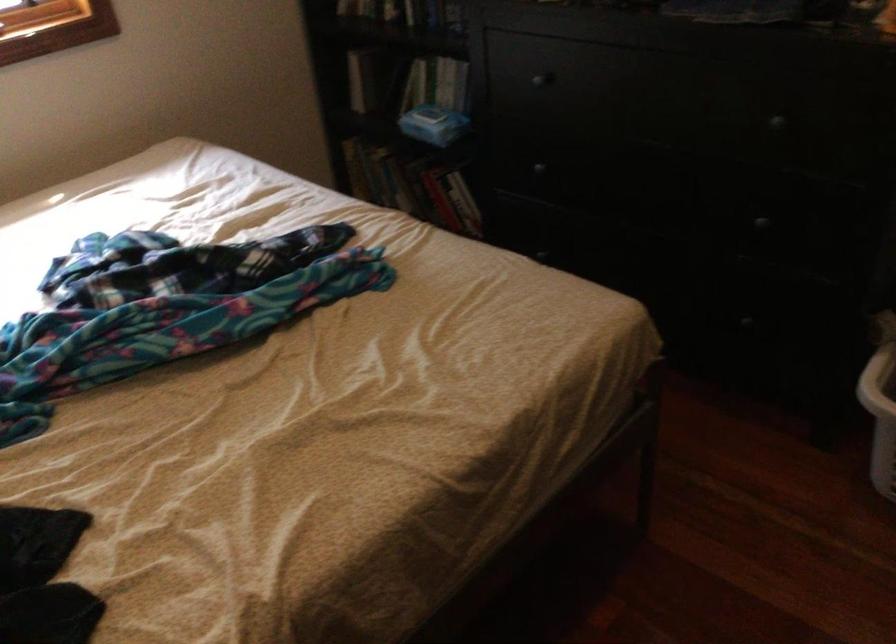
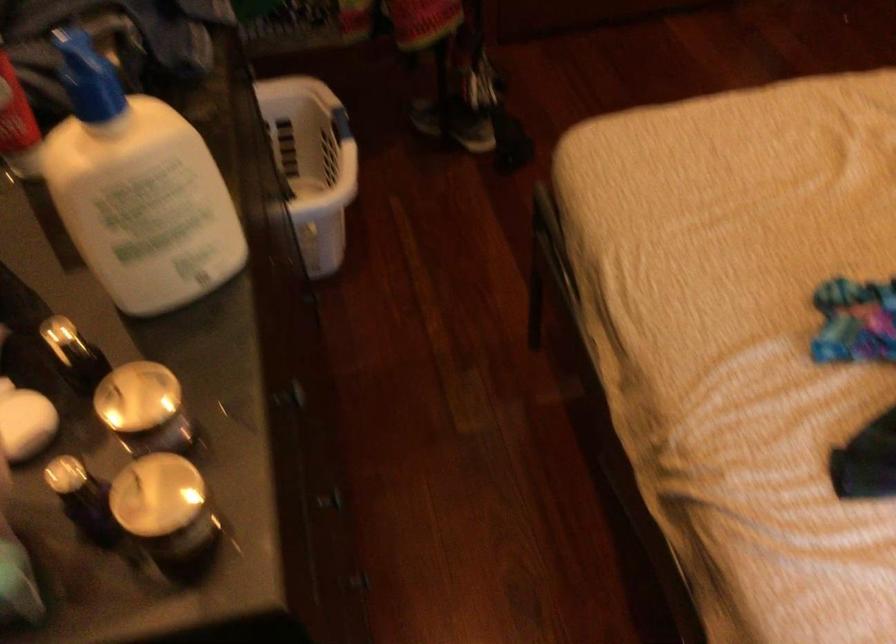
In the second image, find the point that corresponds to [552,166] in the first image.

(330, 500)